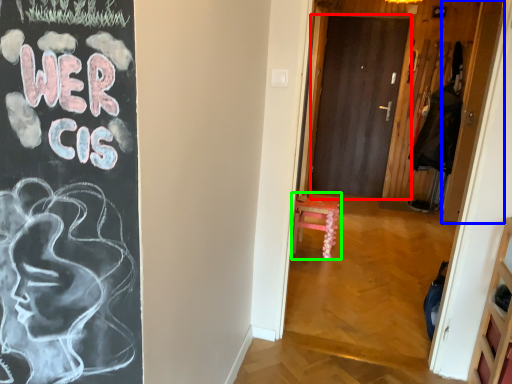
Question: Which object is the closest to the door (highlighted by a red box)? Choose among these: door (highlighted by a blue box) or furniture (highlighted by a green box).

Choices:
 (A) door
 (B) furniture

Answer: (A)